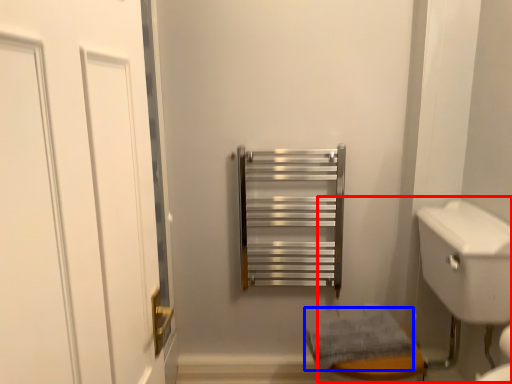
Question: Which of the following is the farthest to the observer, sink (highlighted by a red box) or bath towel (highlighted by a blue box)?

Choices:
 (A) sink
 (B) bath towel

Answer: (B)